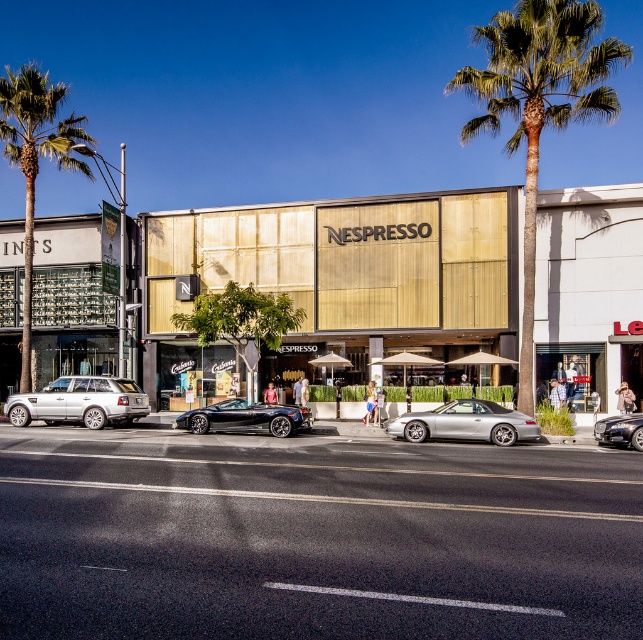
Question: Which point is farther to the camera?

Choices:
 (A) (464, 417)
 (B) (28, 259)
 (C) (640, 189)

Answer: (B)

Question: Is silver metallic car at center smaller than shiny black convertible at center?

Choices:
 (A) yes
 (B) no

Answer: (B)

Question: Is green leafy palm tree at center closer to camera compared to green leafy palm tree at left?

Choices:
 (A) no
 (B) yes

Answer: (B)

Question: Based on their relative distances, which object is farther from the shiny black convertible at center?

Choices:
 (A) green leafy palm tree at left
 (B) shiny black car at center
 (C) silver metallic suv at left
 (D) green leafy palm tree at center

Answer: (D)

Question: Estimate the real-world distances between objects in this image. Which object is farther from the green leafy palm tree at center?

Choices:
 (A) silver metallic suv at left
 (B) shiny black car at center

Answer: (A)

Question: Can you confirm if silver metallic suv at left is wider than shiny black car at center?

Choices:
 (A) no
 (B) yes

Answer: (B)